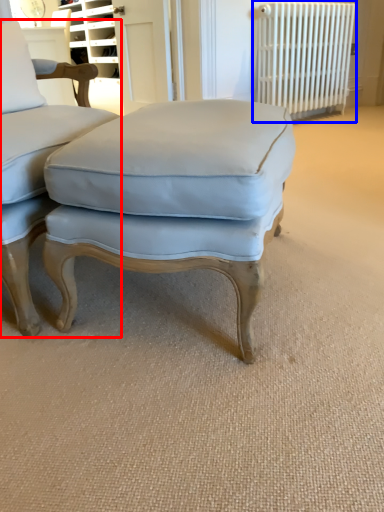
Question: Which object appears closest to the camera in this image, chair (highlighted by a red box) or radiator (highlighted by a blue box)?

Choices:
 (A) chair
 (B) radiator

Answer: (A)